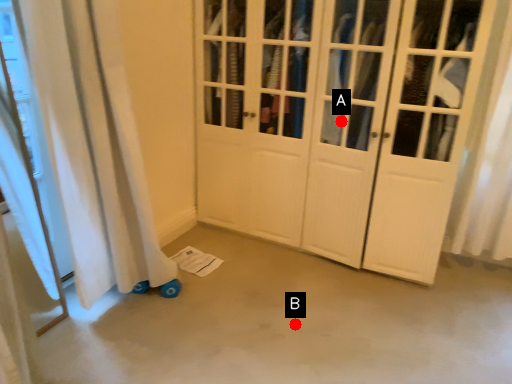
Question: Two points are circled on the image, labeled by A and B beside each circle. Which of the following is the farthest from the observer?

Choices:
 (A) A is further
 (B) B is further

Answer: (A)